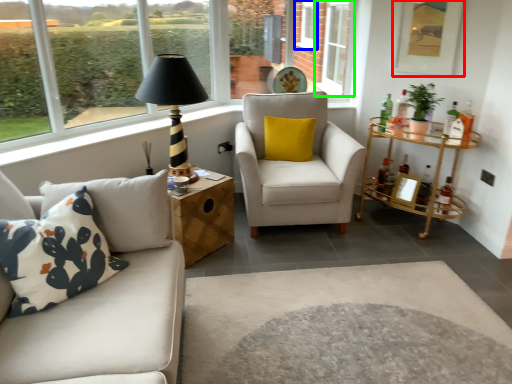
Question: Considering the real-world distances, which object is closest to picture frame (highlighted by a red box)? window (highlighted by a blue box) or window (highlighted by a green box).

Choices:
 (A) window
 (B) window

Answer: (B)